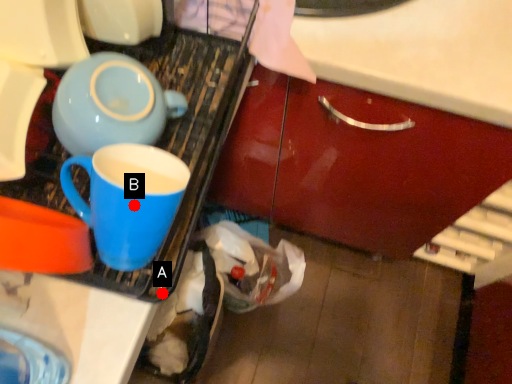
Question: Two points are circled on the image, labeled by A and B beside each circle. Which point is farther to the camera?

Choices:
 (A) A is further
 (B) B is further

Answer: (A)